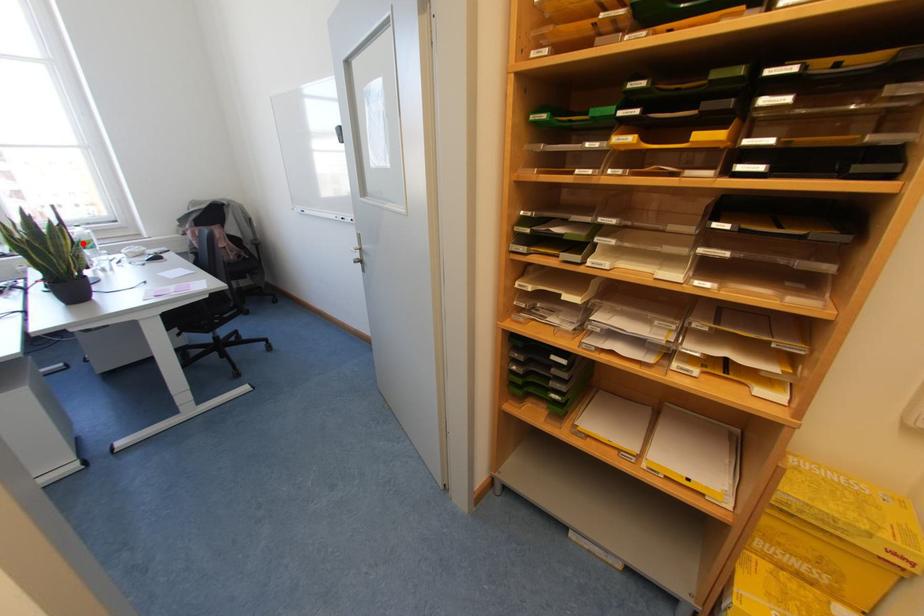
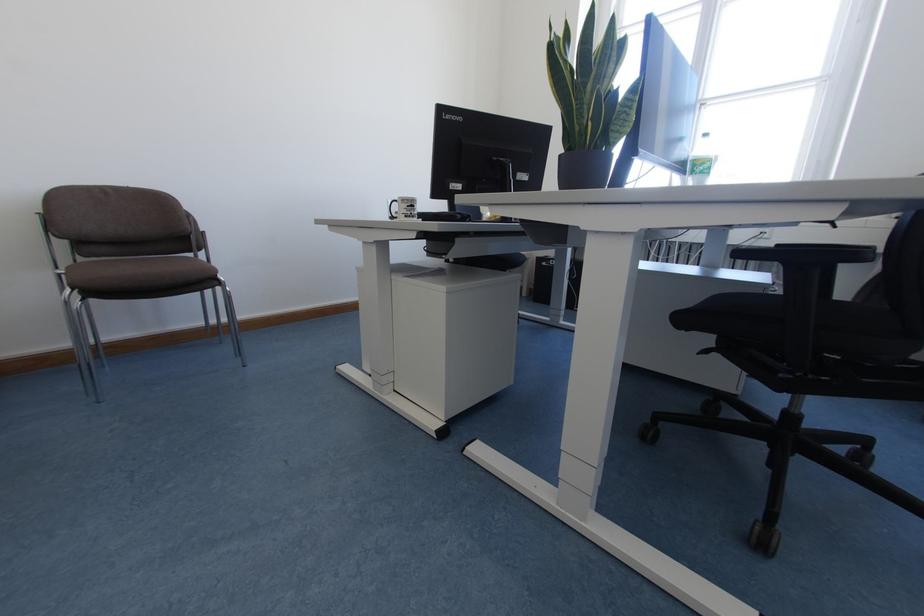
Find the pixel in the second image that matches the highlighted location in the first image.

(694, 164)